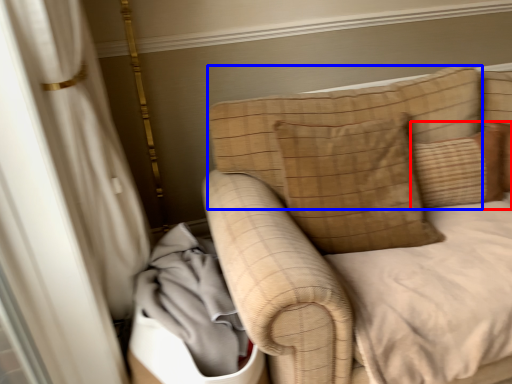
Question: Among these objects, which one is nearest to the camera, pillow (highlighted by a red box) or pillow (highlighted by a blue box)?

Choices:
 (A) pillow
 (B) pillow

Answer: (B)